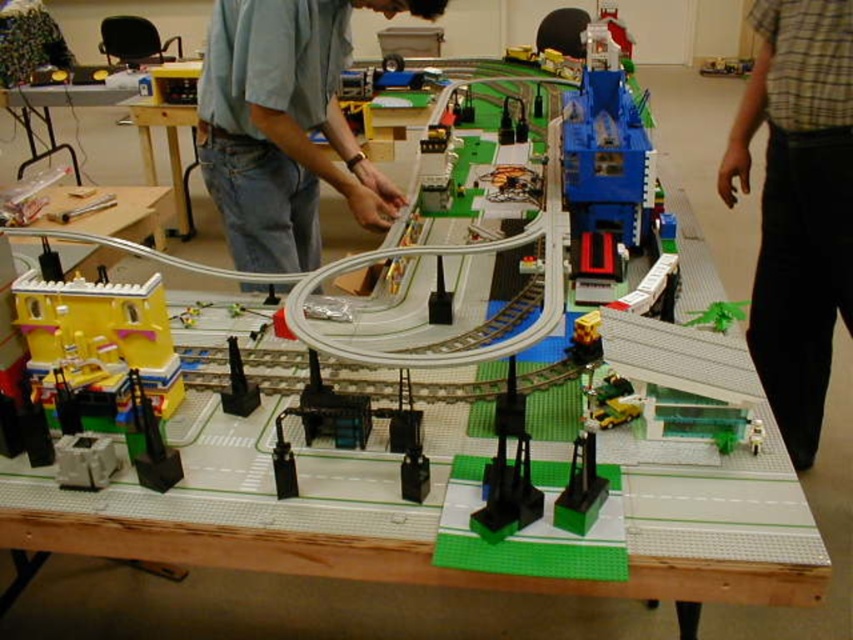
Can you confirm if plaid shirt at right is positioned below light blue denim jeans at center?

Yes, plaid shirt at right is below light blue denim jeans at center.

Describe the element at coordinates (798, 204) in the screenshot. This screenshot has width=853, height=640. I see `plaid shirt at right` at that location.

Locate an element on the screen. The height and width of the screenshot is (640, 853). plaid shirt at right is located at coordinates (798, 204).

Does light blue denim jeans at center have a larger size compared to yellow plastic building at lower left?

Yes.

Which is behind, point (258, 259) or point (38, 305)?

Positioned behind is point (258, 259).

You are a GUI agent. You are given a task and a screenshot of the screen. Output one action in this format:
    pyautogui.click(x=<x>, y=<y>)
    Task: Click on the light blue denim jeans at center
    
    Given the screenshot: What is the action you would take?
    pyautogui.click(x=283, y=125)

How distant is plaid shirt at right from white plastic table at upper left?

plaid shirt at right is 1.89 meters from white plastic table at upper left.

Is plaid shirt at right shorter than white plastic table at upper left?

In fact, plaid shirt at right may be taller than white plastic table at upper left.

Which is in front, point (842, 12) or point (120, 209)?

Positioned in front is point (842, 12).

Identify the location of plaid shirt at right. (798, 204).